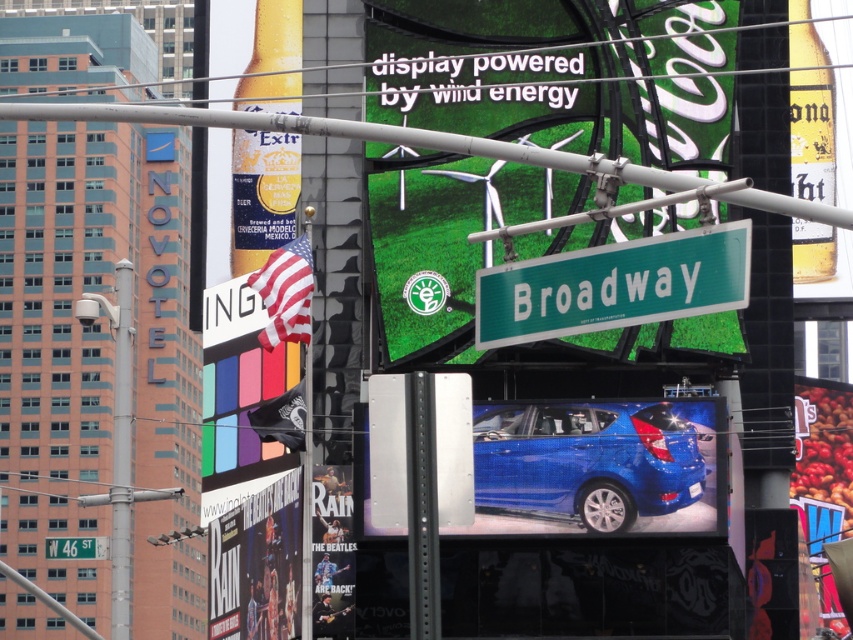
You are a photographer standing in Times Square, New York City. You notice a matte black guitar at lower left and a green metallic street sign at lower left. Which object is positioned more to the right side?

The matte black guitar at lower left is positioned to the right of the green metallic street sign at lower left, so the matte black guitar at lower left is more to the right side.

You are a photographer standing in the middle of the street in this scene. You want to take a photo of both the matte black guitar at lower left and the green metallic street sign at lower left. Which object should you focus on first if you want to ensure both are in the frame without moving the camera?

The matte black guitar at lower left has a lesser height compared to the green metallic street sign at lower left. Since the guitar is shorter, you should focus on the guitar first to ensure both objects are within the frame.